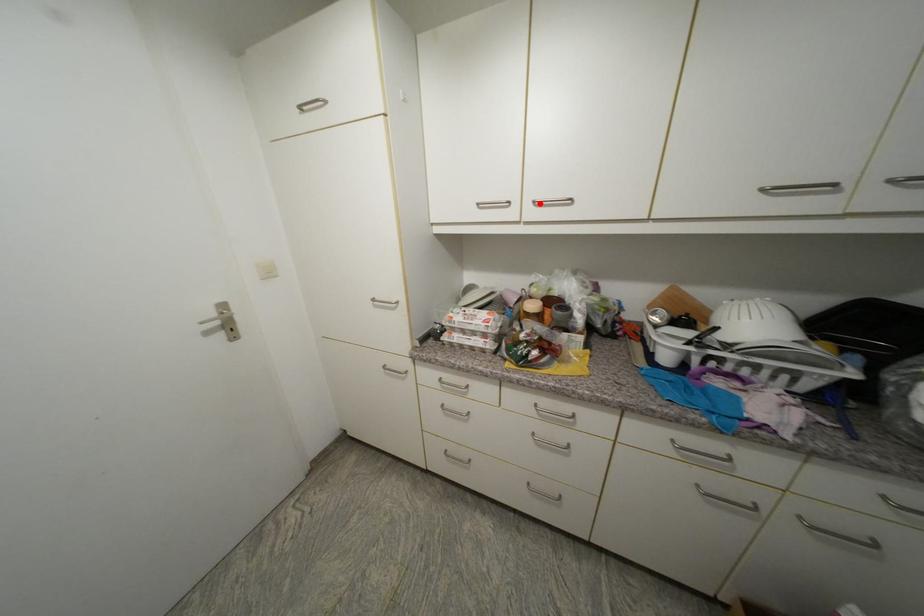
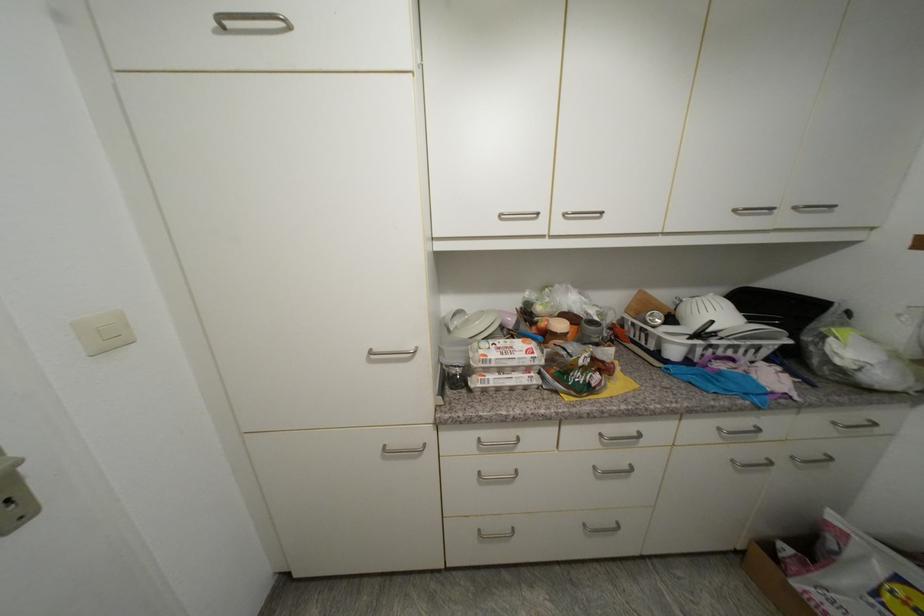
The point at the highlighted location is marked in the first image. Where is the corresponding point in the second image?

(570, 216)